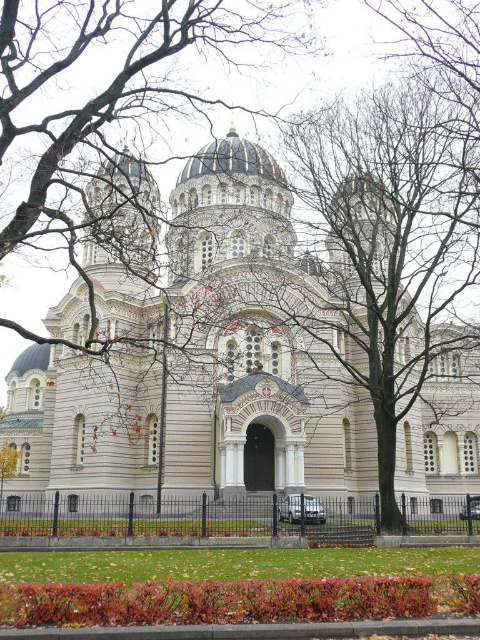
Question: Which object is closer to the camera taking this photo?

Choices:
 (A) white stone church at center
 (B) green grass at lower center

Answer: (B)

Question: Does white stone church at center appear on the right side of green grass at lower center?

Choices:
 (A) no
 (B) yes

Answer: (A)

Question: Which point is farther to the camera?

Choices:
 (A) white stone church at center
 (B) green grass at lower center

Answer: (A)

Question: Is white stone church at center wider than green grass at lower center?

Choices:
 (A) yes
 (B) no

Answer: (A)

Question: Does white stone church at center have a lesser width compared to green grass at lower center?

Choices:
 (A) yes
 (B) no

Answer: (B)